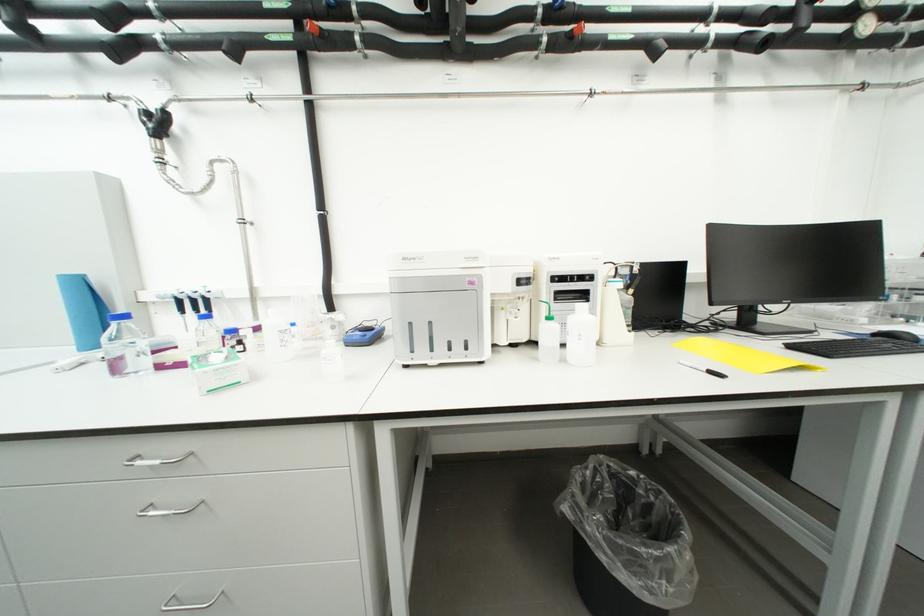
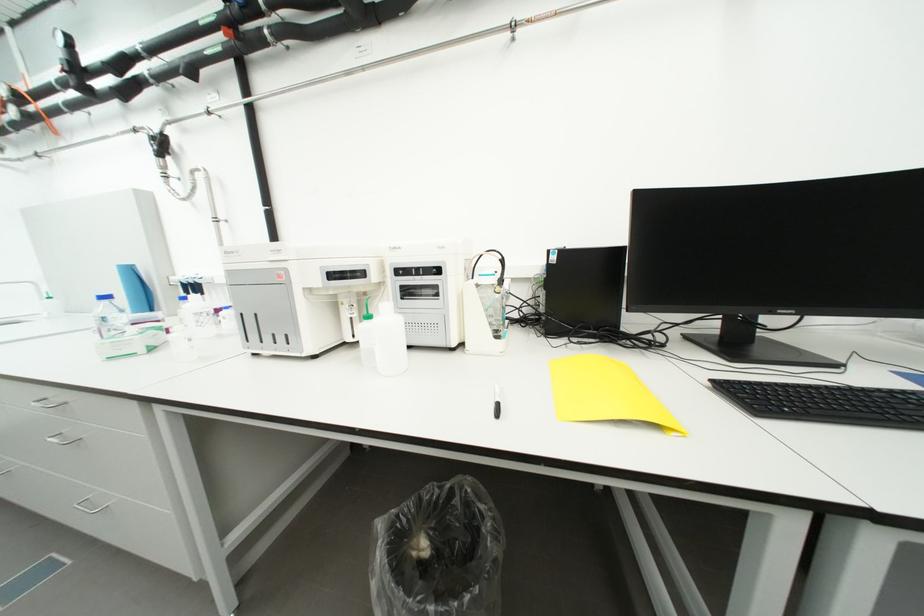
Find the pixel in the second image that matches point (603, 471) in the first image.

(459, 493)